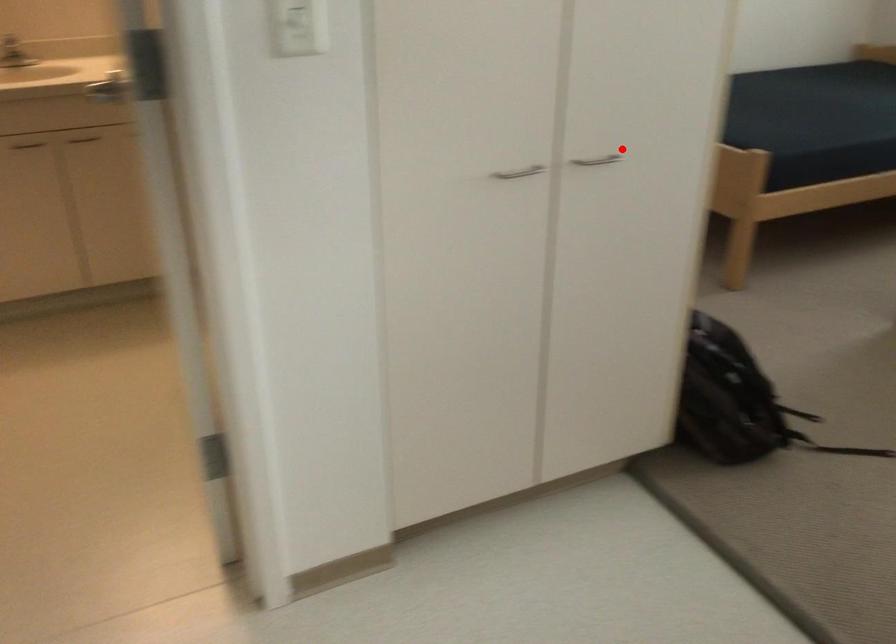
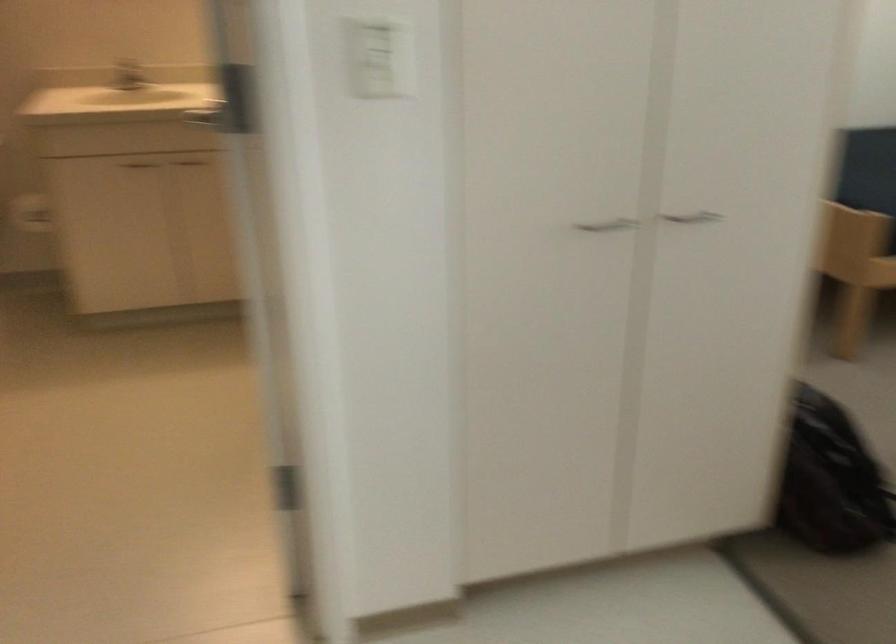
Question: I am providing you with two images of the same scene from different viewpoints. A red point is marked on the first image. Can you still see the location of the red point in image 2?

Choices:
 (A) Yes
 (B) No

Answer: (A)